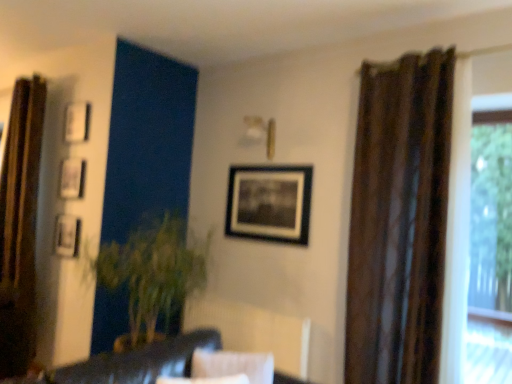
Question: Is matte black picture frame at upper left, which appears as the second picture frame when viewed from the left, thinner than brown textured curtain at right, placed as the 2th curtain when sorted from left to right?

Choices:
 (A) yes
 (B) no

Answer: (A)

Question: From a real-world perspective, is matte black picture frame at upper left, which appears as the second picture frame when viewed from the left, physically below brown textured curtain at right, which appears as the 1th curtain when viewed from the right?

Choices:
 (A) yes
 (B) no

Answer: (B)

Question: Considering the relative sizes of matte black picture frame at upper left, which appears as the second picture frame when viewed from the left, and brown textured curtain at right, positioned as the second curtain in back-to-front order, in the image provided, is matte black picture frame at upper left, which appears as the second picture frame when viewed from the left, smaller than brown textured curtain at right, positioned as the second curtain in back-to-front order,?

Choices:
 (A) yes
 (B) no

Answer: (A)

Question: Could brown textured curtain at right, the first curtain from the front, be considered to be inside matte black picture frame at upper left, arranged as the 3th picture frame when viewed from the right?

Choices:
 (A) no
 (B) yes

Answer: (A)

Question: Considering the relative sizes of matte black picture frame at upper left, arranged as the 3th picture frame when viewed from the right, and brown textured curtain at right, which appears as the 1th curtain when viewed from the right, in the image provided, is matte black picture frame at upper left, arranged as the 3th picture frame when viewed from the right, taller than brown textured curtain at right, which appears as the 1th curtain when viewed from the right,?

Choices:
 (A) yes
 (B) no

Answer: (B)

Question: Does matte black picture frame at upper left, which appears as the second picture frame when viewed from the left, have a larger size compared to brown textured curtain at right, the first curtain from the front?

Choices:
 (A) yes
 (B) no

Answer: (B)

Question: Considering the relative positions of brown textured curtain at left, which is the second curtain from right to left, and white matte picture frame at upper left, placed as the third picture frame when sorted from left to right, in the image provided, is brown textured curtain at left, which is the second curtain from right to left, to the left of white matte picture frame at upper left, placed as the third picture frame when sorted from left to right, from the viewer's perspective?

Choices:
 (A) yes
 (B) no

Answer: (A)

Question: Could you tell me if brown textured curtain at left, which is the second curtain from right to left, is turned towards white matte picture frame at upper left, the second picture frame when ordered from right to left?

Choices:
 (A) yes
 (B) no

Answer: (B)

Question: Does brown textured curtain at left, the first curtain positioned from the left, have a greater width compared to white matte picture frame at upper left, placed as the third picture frame when sorted from left to right?

Choices:
 (A) yes
 (B) no

Answer: (A)

Question: From a real-world perspective, is brown textured curtain at left, which is the second curtain from right to left, beneath white matte picture frame at upper left, placed as the third picture frame when sorted from left to right?

Choices:
 (A) no
 (B) yes

Answer: (B)

Question: Is brown textured curtain at left, which appears as the first curtain when viewed from the back, bigger than white matte picture frame at upper left, placed as the third picture frame when sorted from left to right?

Choices:
 (A) no
 (B) yes

Answer: (B)

Question: Does brown textured curtain at left, which is the second curtain from right to left, appear on the right side of white matte picture frame at upper left, placed as the third picture frame when sorted from left to right?

Choices:
 (A) no
 (B) yes

Answer: (A)

Question: Is metallic silver picture frame at upper left, marked as the 1th picture frame in a left-to-right arrangement, surrounding matte black picture frame at upper left, which appears as the second picture frame when viewed from the left?

Choices:
 (A) no
 (B) yes

Answer: (A)